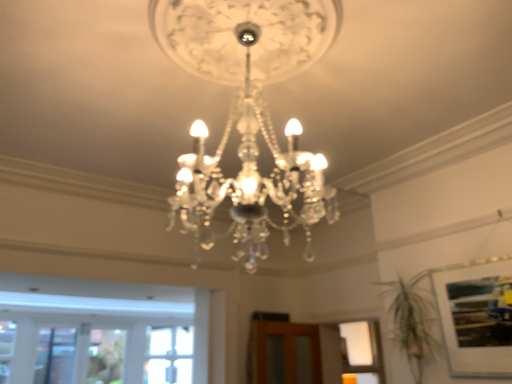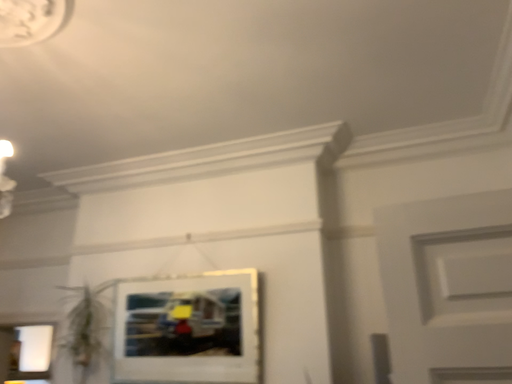
Question: How did the camera likely rotate when shooting the video?

Choices:
 (A) rotated left
 (B) rotated right

Answer: (B)